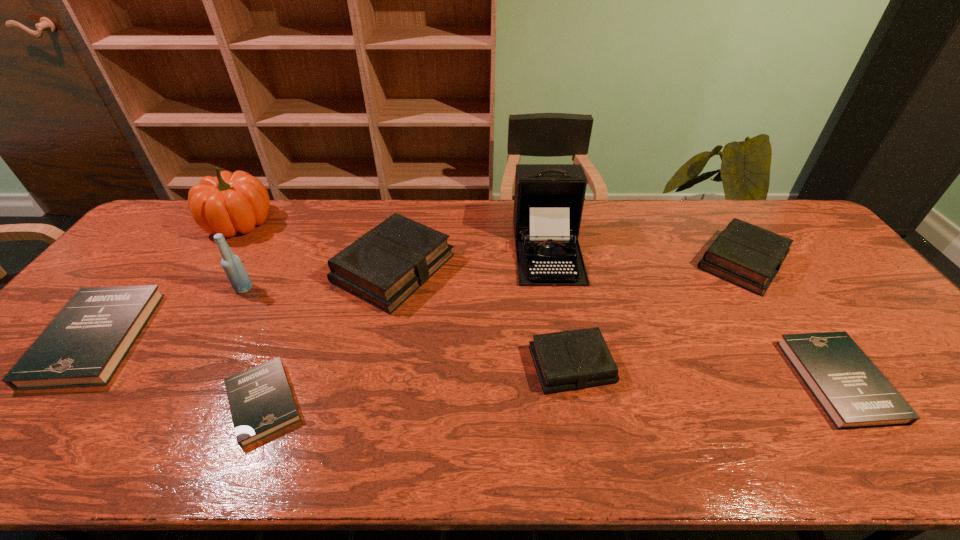
Identify the location of typewriter. The height and width of the screenshot is (540, 960). (548, 202).

Identify the location of pumpkin. (229, 203).

Where is `bottle`? This screenshot has width=960, height=540. bottle is located at coordinates (234, 269).

Identify the location of the leftmost greenish book. The height and width of the screenshot is (540, 960). (384, 267).

Locate an element on the screen. The height and width of the screenshot is (540, 960). the biggest greenish book is located at coordinates coord(384,267).

I want to click on the second biggest greenish book, so click(x=746, y=255).

In order to click on the fifth tallest object in this screenshot , I will do `click(746, 255)`.

I want to click on the second greenish book from right to left, so click(574, 359).

This screenshot has height=540, width=960. I want to click on the fourth shortest book, so click(x=574, y=359).

Locate an element on the screen. the biggest dark book is located at coordinates (83, 346).